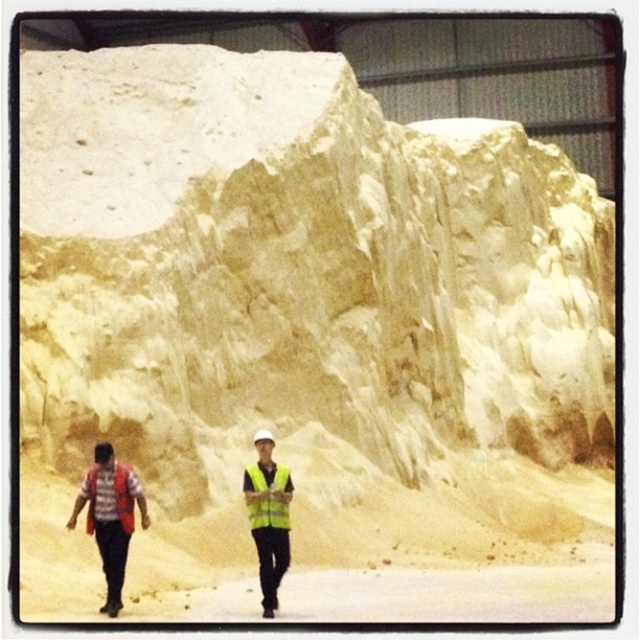
Question: Which point is farther to the camera?

Choices:
 (A) yellow reflective safety vest at center
 (B) red reflective vest at left

Answer: (A)

Question: Where is yellowish sandstone cliff at upper center located in relation to yellow reflective safety vest at center in the image?

Choices:
 (A) left
 (B) right

Answer: (B)

Question: Among these points, which one is nearest to the camera?

Choices:
 (A) (257, 536)
 (B) (253, 470)
 (C) (125, 474)
 (D) (109, 273)

Answer: (C)

Question: Does yellow reflective vest at center lie behind yellow reflective safety vest at center?

Choices:
 (A) yes
 (B) no

Answer: (B)

Question: Based on their relative distances, which object is nearer to the yellowish sandstone cliff at upper center?

Choices:
 (A) reflective yellow safety vest at left
 (B) yellow reflective safety vest at center

Answer: (A)

Question: Can you confirm if red reflective vest at left is bigger than reflective yellow safety vest at left?

Choices:
 (A) no
 (B) yes

Answer: (A)